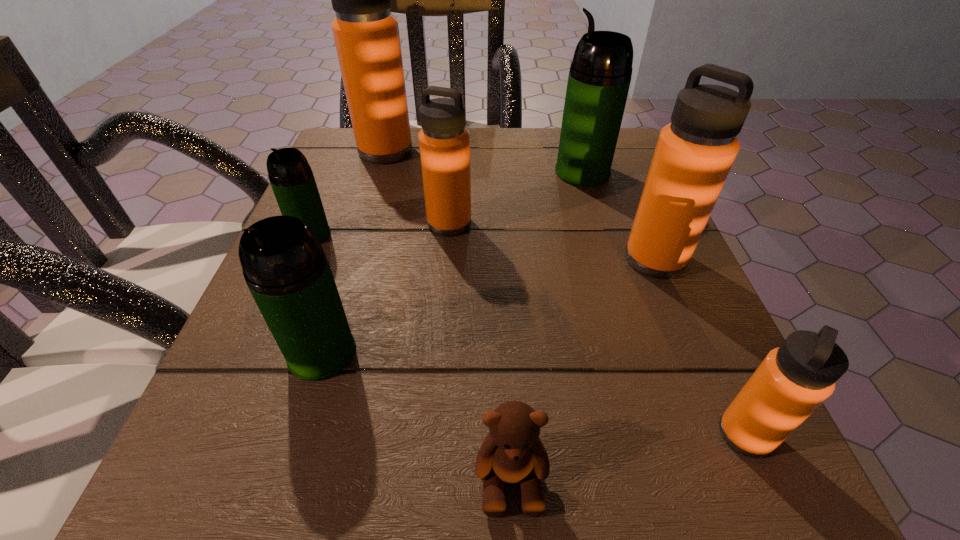
Image resolution: width=960 pixels, height=540 pixels. Identify the location of green thermos bottle object that ranks as the second closest to the second biggest green thermos bottle. (600, 74).

Locate an element on the screen. This screenshot has height=540, width=960. free space that satisfies the following two spatial constraints: 1. on the front side of the nearest orange thermos bottle; 2. on the right side of the second orange thermos bottle from left to right is located at coordinates (433, 434).

This screenshot has width=960, height=540. I want to click on vacant space that satisfies the following two spatial constraints: 1. from the spout of the smallest orange thermos bottle; 2. on the left side of the smallest green thermos bottle, so click(227, 434).

Identify the location of vacant space that satisfies the following two spatial constraints: 1. on the front side of the third farthest orange thermos bottle; 2. on the left side of the third nearest orange thermos bottle. (446, 259).